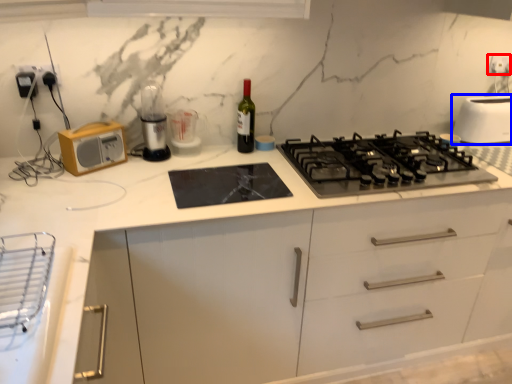
Question: Which of the following is the closest to the observer, electric outlet (highlighted by a red box) or toaster (highlighted by a blue box)?

Choices:
 (A) electric outlet
 (B) toaster

Answer: (B)